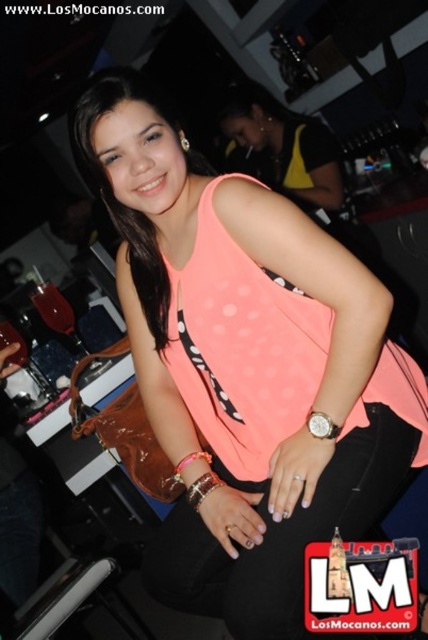
Question: Does neon orange fabric top at center appear on the right side of leather wristband at lower center?

Choices:
 (A) no
 (B) yes

Answer: (B)

Question: Estimate the real-world distances between objects in this image. Which object is farther from the silver metallic bracelet at wrist?

Choices:
 (A) neon orange fabric top at center
 (B) leather wristband at lower center

Answer: (A)

Question: Can you confirm if neon orange fabric top at center is positioned to the left of leather wristband at lower center?

Choices:
 (A) yes
 (B) no

Answer: (B)

Question: Can you confirm if neon orange fabric top at center is positioned below silver metallic bracelet at wrist?

Choices:
 (A) no
 (B) yes

Answer: (A)

Question: Which point is closer to the camera?

Choices:
 (A) leather wristband at lower center
 (B) neon orange fabric top at center

Answer: (B)

Question: Which point is farther from the camera taking this photo?

Choices:
 (A) (157, 429)
 (B) (216, 477)
 (C) (208, 458)

Answer: (A)